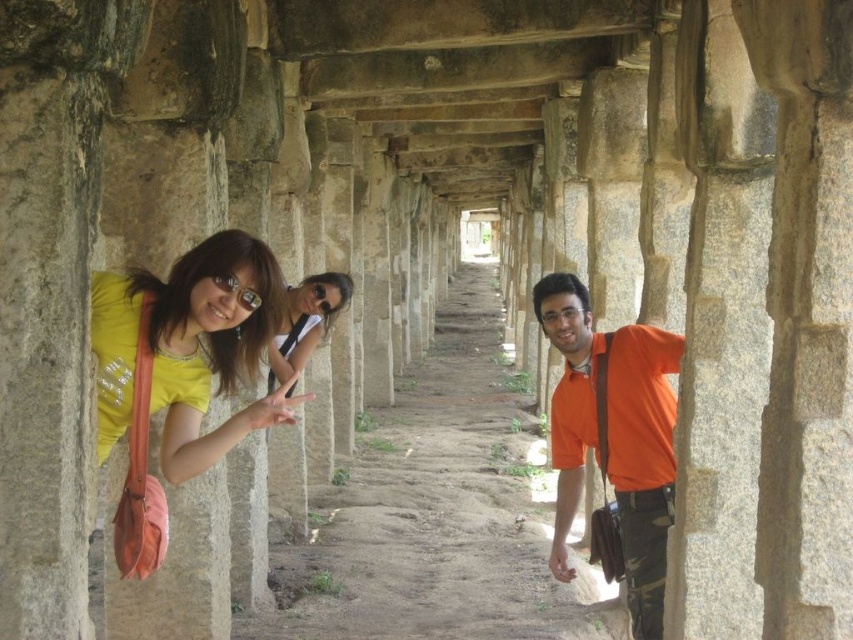
You are a photographer positioned at the entrance of the corridor. You want to take a photo that includes both the yellow fabric bag at left and the sunglasses at center. Given that your camera has a maximum focus range of 8 meters, will both objects be in focus?

The yellow fabric bag at left is 7.88 meters from sunglasses at center. Since the distance between them is within the camera maximum focus range of 8 meters, both objects will be in focus.

You are a photographer trying to capture a clear shot of the orange cotton shirt at center and the sunglasses at center in the corridor. Since the person in the middle is partially obscured, which object should you focus on to ensure it is fully visible in your photo?

The sunglasses at center should be focused on because the orange cotton shirt at center is positioned under it, meaning the shirt might be blocked by the sunglasses or the person in front, making the sunglasses more accessible to capture clearly.